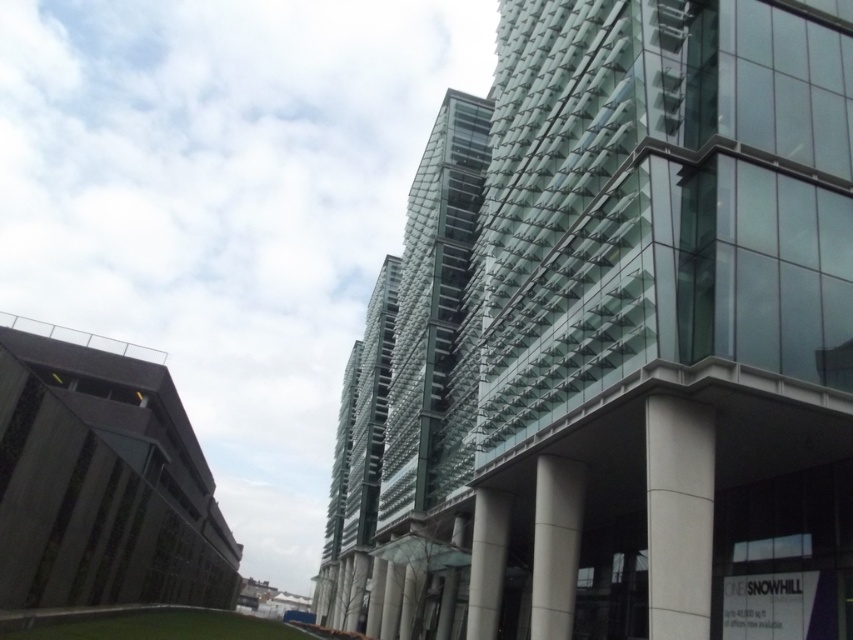
You are standing in the middle of the city and see the transparent glass building at center and the white concrete pillar at lower right. Which object would appear larger when viewed from your current position?

The transparent glass building at center appears larger because it is much taller than the white concrete pillar at lower right.

You are standing in the modern architectural scene described. There is a point at coordinates (621, 330). What can you see at that point?

At point (621, 330) lies transparent glass building at center.

Consider the image. You are standing in the modern architectural scene and want to determine which of the two points, point (705,550) or point (544,525), is closer to you. Based on the scene description, which point is nearer?

Point (705,550) is closer to the camera than point (544,525).